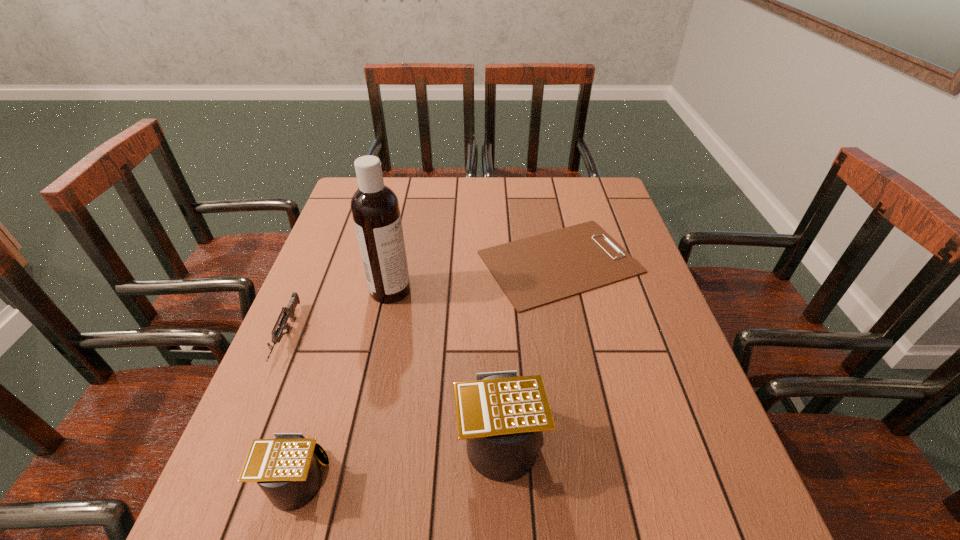
Locate an element on the screen. blank region between the shorter calculator and the shortest object is located at coordinates (428, 369).

You are a GUI agent. You are given a task and a screenshot of the screen. Output one action in this format:
    pyautogui.click(x=<x>, y=<y>)
    Task: Click on the free space between the right calculator and the shortest object
    This screenshot has height=540, width=960.
    Given the screenshot: What is the action you would take?
    pyautogui.click(x=530, y=349)

The height and width of the screenshot is (540, 960). What are the coordinates of `unoccupied position between the tallest object and the left calculator` in the screenshot? It's located at (344, 383).

The height and width of the screenshot is (540, 960). Identify the location of object that is the third nearest to the clipboard. (285, 468).

Choose which object is the fourth nearest neighbor to the dishwasher detergent. Please provide its 2D coordinates. Your answer should be formatted as a tuple, i.e. [(x, y)], where the tuple contains the x and y coordinates of a point satisfying the conditions above.

[(285, 468)]

Find the location of a particular element. Image resolution: width=960 pixels, height=540 pixels. free space that satisfies the following two spatial constraints: 1. aimed along the barrel of the taller calculator; 2. on the left side of the leftmost object is located at coordinates (245, 436).

Image resolution: width=960 pixels, height=540 pixels. Identify the location of vacant space that satisfies the following two spatial constraints: 1. on the label side of the second tallest object; 2. on the left side of the dishwasher detergent. (359, 436).

Locate an element on the screen. Image resolution: width=960 pixels, height=540 pixels. free space that satisfies the following two spatial constraints: 1. on the back side of the taller calculator; 2. on the label side of the tallest object is located at coordinates (494, 291).

You are a GUI agent. You are given a task and a screenshot of the screen. Output one action in this format:
    pyautogui.click(x=<x>, y=<y>)
    Task: Click on the free space that satisfies the following two spatial constraints: 1. aimed along the barrel of the gun; 2. on the left side of the left calculator
    Image resolution: width=960 pixels, height=540 pixels.
    Given the screenshot: What is the action you would take?
    pyautogui.click(x=228, y=476)

Where is `free region that satisfies the following two spatial constraints: 1. aimed along the barrel of the second shortest object; 2. on the left side of the taller calculator`? This screenshot has width=960, height=540. free region that satisfies the following two spatial constraints: 1. aimed along the barrel of the second shortest object; 2. on the left side of the taller calculator is located at coordinates (245, 436).